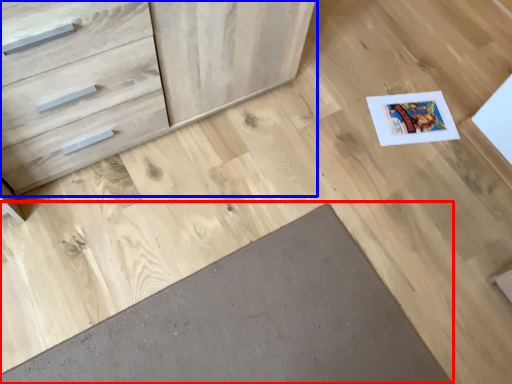
Question: Which object appears farthest to the camera in this image, doormat (highlighted by a red box) or chest of drawers (highlighted by a blue box)?

Choices:
 (A) doormat
 (B) chest of drawers

Answer: (A)